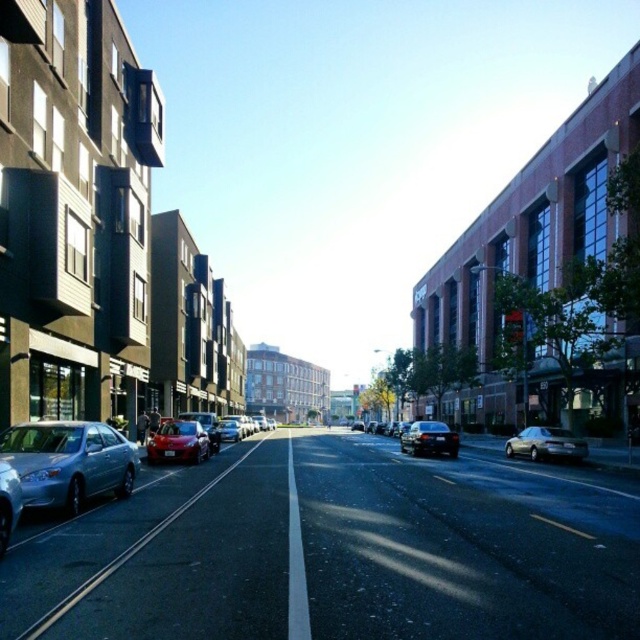
Is shiny silver sedan at center thinner than shiny red sedan at center?

No, shiny silver sedan at center is not thinner than shiny red sedan at center.

Is point (557, 442) behind point (230, 435)?

No.

Image resolution: width=640 pixels, height=640 pixels. What are the coordinates of `shiny silver sedan at center` in the screenshot? It's located at (545, 444).

Does shiny black sedan at center lie behind shiny red sedan at center?

No.

Does shiny black sedan at center have a greater height compared to shiny red sedan at center?

Indeed, shiny black sedan at center has a greater height compared to shiny red sedan at center.

Where is `shiny black sedan at center`? The height and width of the screenshot is (640, 640). shiny black sedan at center is located at coordinates (429, 438).

Is satin silver sedan at left to the left of shiny silver sedan at center from the viewer's perspective?

Yes, satin silver sedan at left is to the left of shiny silver sedan at center.

Between satin silver sedan at left and shiny silver sedan at center, which one appears on the left side from the viewer's perspective?

satin silver sedan at left is more to the left.

Image resolution: width=640 pixels, height=640 pixels. In order to click on satin silver sedan at left in this screenshot , I will do `click(68, 461)`.